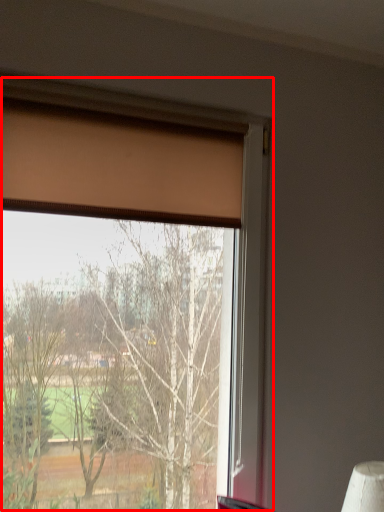
Question: From the image's perspective, what is the correct spatial relationship of window (annotated by the red box) in relation to curtain?

Choices:
 (A) below
 (B) above

Answer: (A)